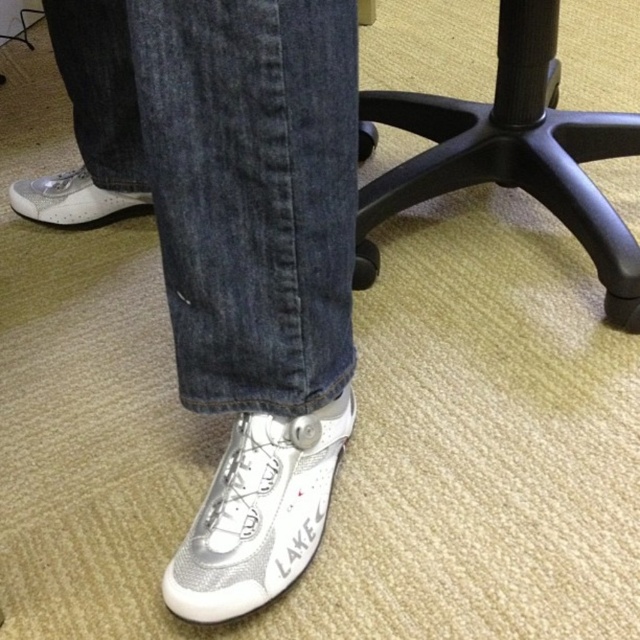
Is point (221, 552) farther from viewer compared to point (125, 211)?

No, (221, 552) is closer to viewer.

Does white mesh shoe at lower center have a lesser height compared to white mesh shoe at lower left?

Incorrect, white mesh shoe at lower center's height does not fall short of white mesh shoe at lower left's.

Between point (269, 499) and point (74, 198), which one is positioned behind?

The point (74, 198) is more distant.

The height and width of the screenshot is (640, 640). Find the location of `white mesh shoe at lower center`. white mesh shoe at lower center is located at coordinates (259, 513).

Is white mesh shoe at center to the left of white mesh shoe at lower left from the viewer's perspective?

In fact, white mesh shoe at center is to the right of white mesh shoe at lower left.

Where is `white mesh shoe at center`? This screenshot has height=640, width=640. white mesh shoe at center is located at coordinates (237, 248).

Locate an element on the screen. white mesh shoe at center is located at coordinates (237, 248).

I want to click on white mesh shoe at center, so click(237, 248).

Does white mesh shoe at center have a greater width compared to black plastic chair at center?

No.

Is white mesh shoe at center smaller than black plastic chair at center?

Yes.

Which is in front, point (352, 273) or point (522, 90)?

Point (352, 273)

I want to click on white mesh shoe at center, so click(x=237, y=248).